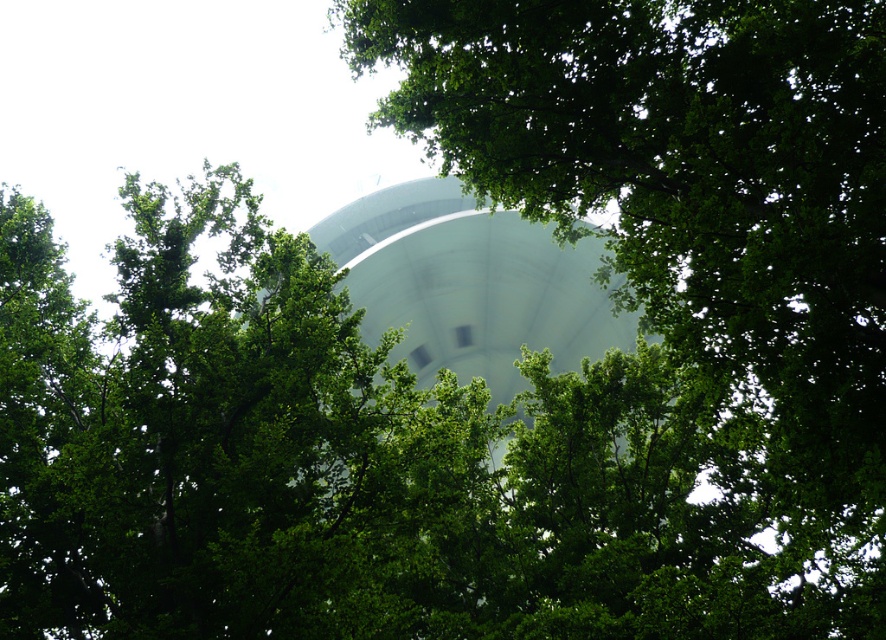
Is green leafy tree at center thinner than white smooth water tower at center?

Yes, green leafy tree at center is thinner than white smooth water tower at center.

The width and height of the screenshot is (886, 640). In order to click on green leafy tree at center in this screenshot , I will do `click(682, 292)`.